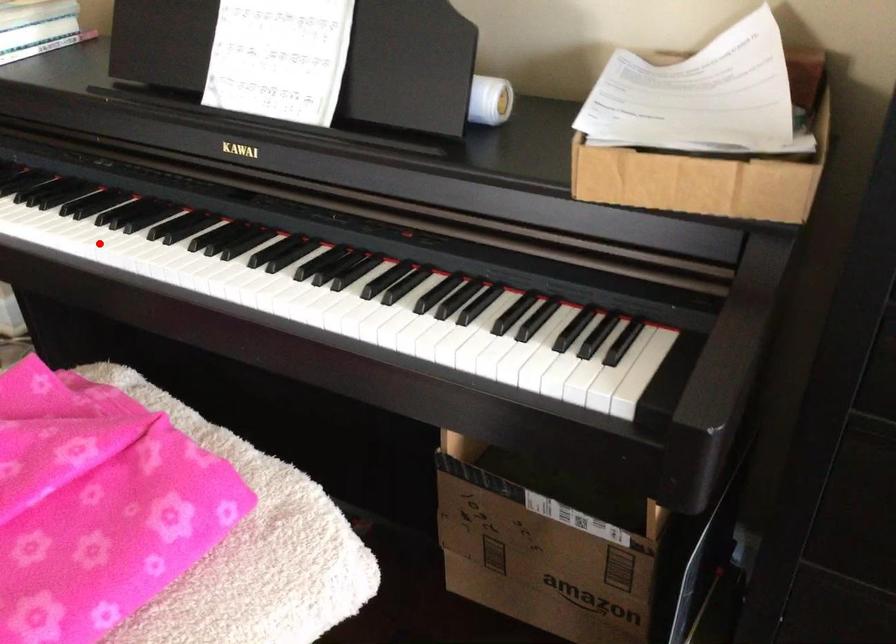
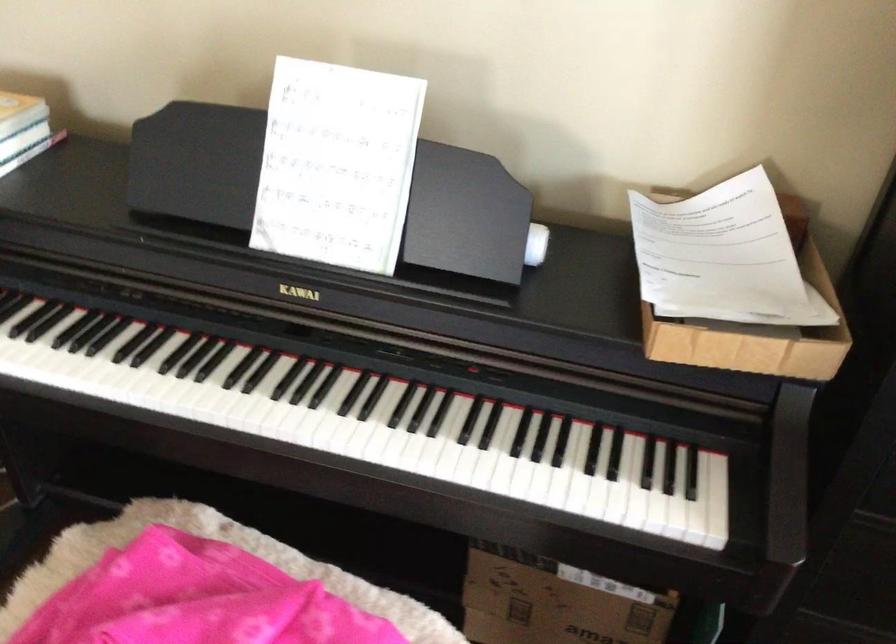
Where in the second image is the point corresponding to the highlighted location from the first image?

(177, 397)